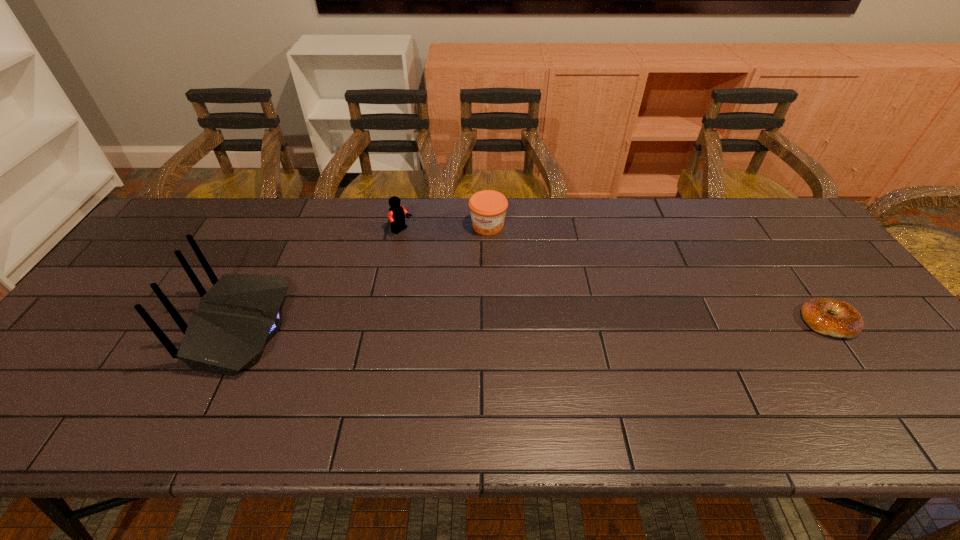
The width and height of the screenshot is (960, 540). In order to click on router in this screenshot , I will do `click(240, 312)`.

The height and width of the screenshot is (540, 960). I want to click on the tallest object, so click(x=240, y=312).

Where is `bagel`? This screenshot has height=540, width=960. bagel is located at coordinates (847, 323).

You are a GUI agent. You are given a task and a screenshot of the screen. Output one action in this format:
    pyautogui.click(x=<x>, y=<y>)
    Task: Click on the shortest object
    This screenshot has height=540, width=960.
    Given the screenshot: What is the action you would take?
    pyautogui.click(x=847, y=323)

The height and width of the screenshot is (540, 960). What are the coordinates of `the second object from right to left` in the screenshot? It's located at (488, 208).

Where is `jam`? The height and width of the screenshot is (540, 960). jam is located at coordinates (488, 208).

This screenshot has height=540, width=960. Find the location of `Lego`. Lego is located at coordinates (397, 212).

Where is `the third shortest object`? the third shortest object is located at coordinates (397, 212).

Identify the location of vacant space situated on the back of the tallest object. The image size is (960, 540). (178, 327).

The image size is (960, 540). What are the coordinates of `free space located 0.150m on the back of the tallest object` in the screenshot? It's located at (141, 327).